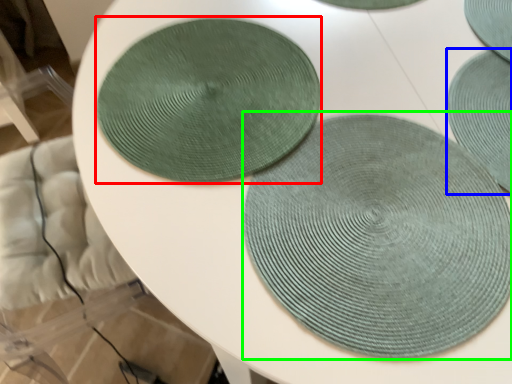
Question: Based on their relative distances, which object is farther from coaster (highlighted by a red box)? Choose from mat (highlighted by a blue box) and mat (highlighted by a green box).

Choices:
 (A) mat
 (B) mat

Answer: (A)